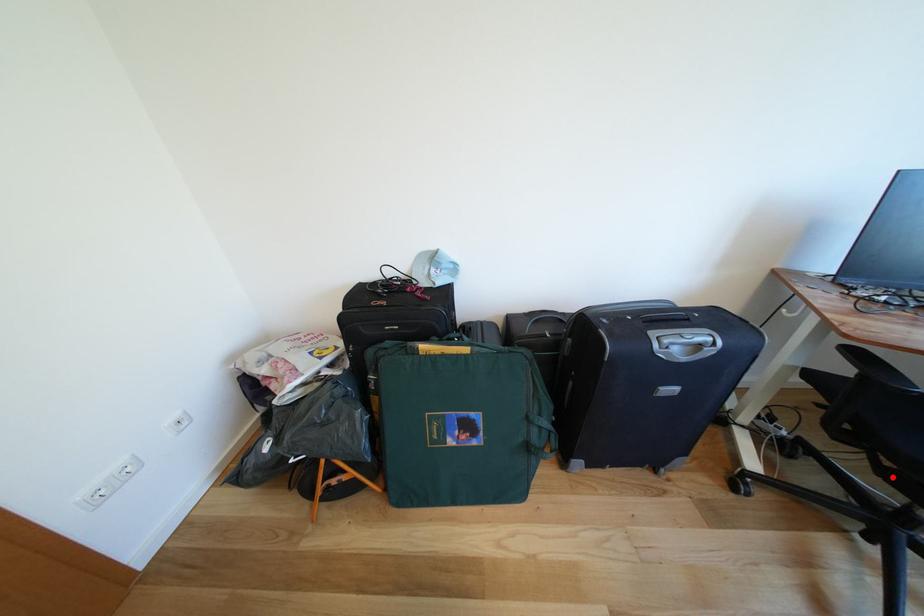
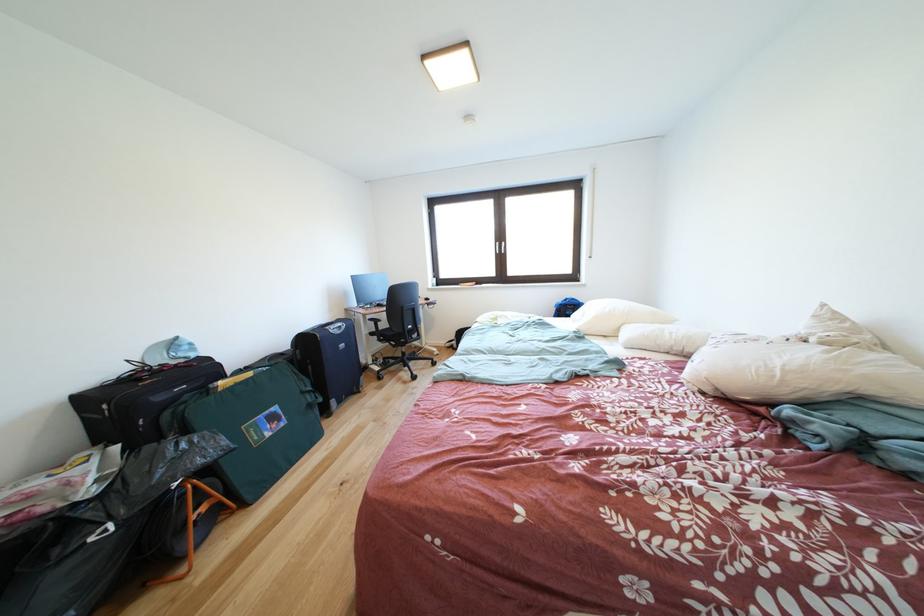
The point at the highlighted location is marked in the first image. Where is the corresponding point in the second image?

(403, 351)